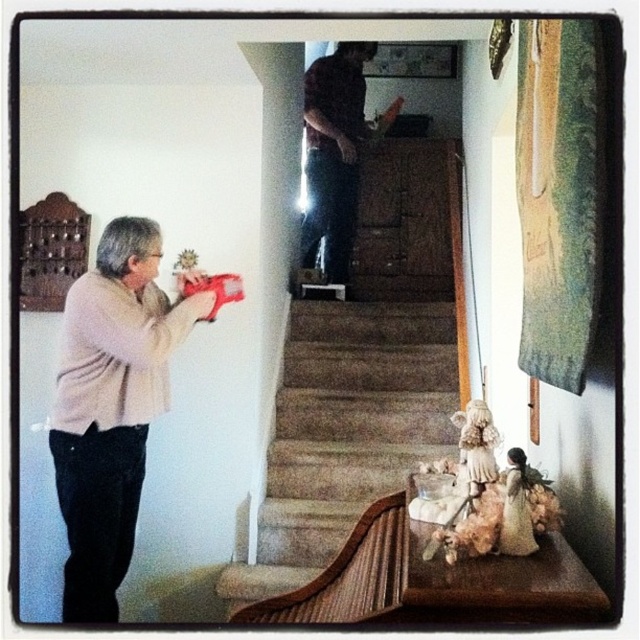
Question: Is the position of carpeted stairs at center more distant than that of dark brown shirt at upper center?

Choices:
 (A) no
 (B) yes

Answer: (A)

Question: Which point appears farthest from the camera in this image?

Choices:
 (A) (401, 481)
 (B) (157, 337)

Answer: (A)

Question: Estimate the real-world distances between objects in this image. Which object is closer to the beige sweater at left?

Choices:
 (A) dark brown shirt at upper center
 (B) carpeted stairs at center

Answer: (B)

Question: Can you confirm if beige sweater at left is bigger than dark brown shirt at upper center?

Choices:
 (A) yes
 (B) no

Answer: (A)

Question: Among these objects, which one is nearest to the camera?

Choices:
 (A) carpeted stairs at center
 (B) dark brown shirt at upper center
 (C) beige sweater at left

Answer: (C)

Question: From the image, what is the correct spatial relationship of carpeted stairs at center in relation to dark brown shirt at upper center?

Choices:
 (A) below
 (B) above

Answer: (A)